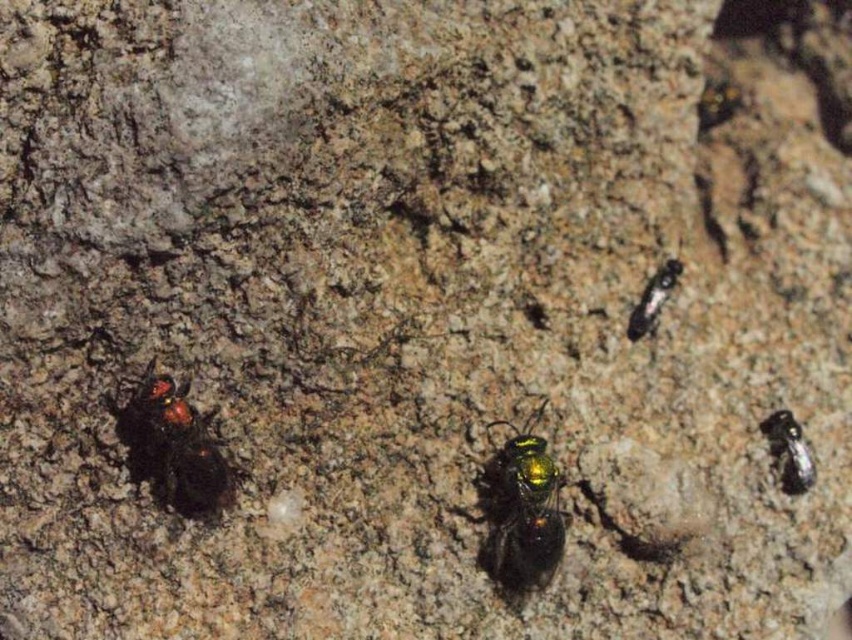
You are an entomologist observing the rock surface. You notice two metallic green insects, the metallic green bee at center and the metallic green insect at lower right. Which one is positioned to the left of the other?

The metallic green bee at center is positioned to the left of the metallic green insect at lower right.

You are an entomologist observing two metallic green insects on a rock. The insects are labeled as the metallic green insect at lower left and the metallic green insect at lower right. Based on their positions, which insect is taller?

The metallic green insect at lower left is taller than the metallic green insect at lower right.